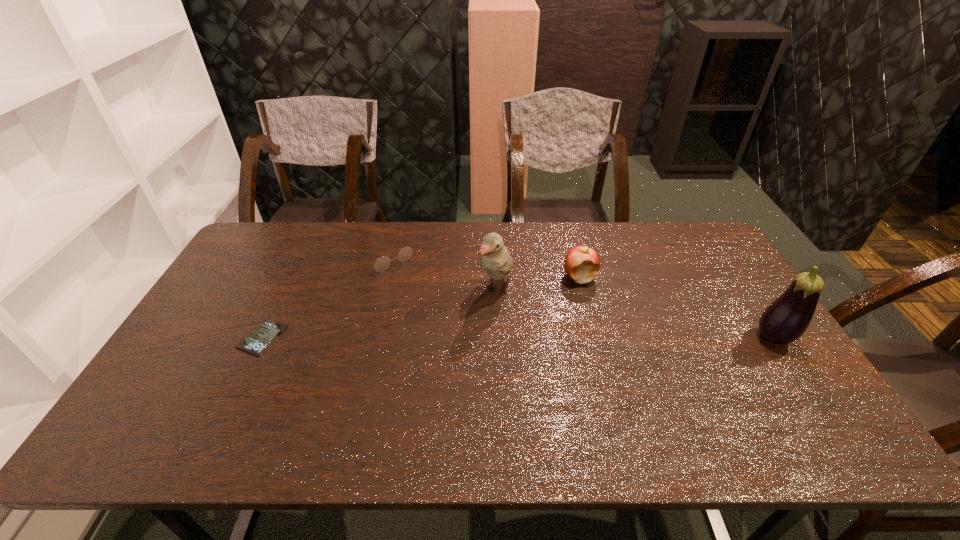
This screenshot has width=960, height=540. I want to click on object that is at the left edge, so click(268, 331).

Where is `object present at the right edge`? This screenshot has width=960, height=540. object present at the right edge is located at coordinates (785, 320).

Where is `free space at the far edge of the desktop`? free space at the far edge of the desktop is located at coordinates (664, 262).

The width and height of the screenshot is (960, 540). Find the location of `vacant region at the near edge of the desktop`. vacant region at the near edge of the desktop is located at coordinates (362, 410).

Identify the location of vacant space at the left edge of the desktop. This screenshot has height=540, width=960. (244, 265).

Where is `vacant space at the right edge`? Image resolution: width=960 pixels, height=540 pixels. vacant space at the right edge is located at coordinates [x=749, y=345].

The image size is (960, 540). In order to click on free space at the far left corner of the desktop in this screenshot , I will do `click(249, 248)`.

At what (x,y) coordinates should I click in order to perform the action: click on free space at the near left corner of the desktop. Please return your answer as a coordinate pair (x, y). This screenshot has height=540, width=960. Looking at the image, I should click on pyautogui.click(x=166, y=400).

In the image, there is a desktop. In order to click on vacant space at the near right corner in this screenshot , I will do pos(778,408).

Where is `empty space that is in between the second shortest object and the eggplant`? The height and width of the screenshot is (540, 960). empty space that is in between the second shortest object and the eggplant is located at coordinates (579, 296).